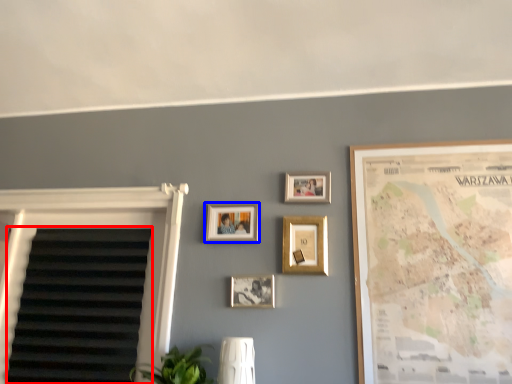
Question: Which object appears farthest to the camera in this image, blind (highlighted by a red box) or picture frame (highlighted by a blue box)?

Choices:
 (A) blind
 (B) picture frame

Answer: (B)